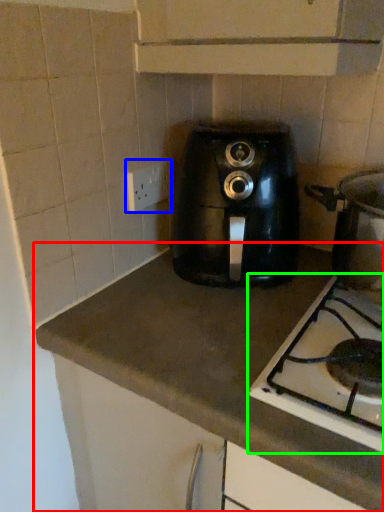
Question: Considering the real-world distances, which object is closest to countertop (highlighted by a red box)? electric outlet (highlighted by a blue box) or gas stove (highlighted by a green box).

Choices:
 (A) electric outlet
 (B) gas stove

Answer: (B)